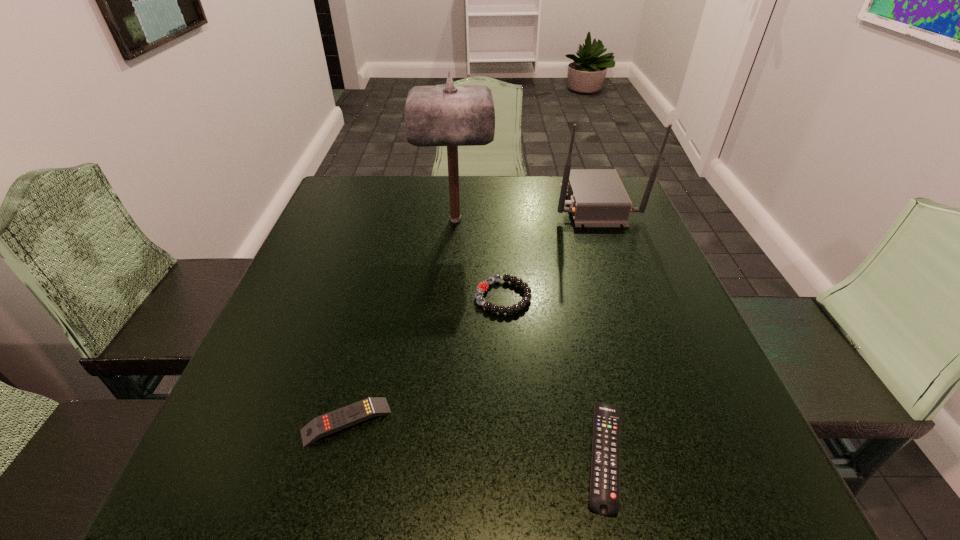
Locate an element on the screen. The width and height of the screenshot is (960, 540). the tallest object is located at coordinates (453, 115).

Locate an element on the screen. Image resolution: width=960 pixels, height=540 pixels. router is located at coordinates (597, 198).

Identify the location of the third nearest object. [483, 286].

Where is `the left remote control`? This screenshot has height=540, width=960. the left remote control is located at coordinates (334, 421).

Where is `the right remote control`? The width and height of the screenshot is (960, 540). the right remote control is located at coordinates (604, 499).

Where is `free region located 0.070m on the right of the mallet`? free region located 0.070m on the right of the mallet is located at coordinates (518, 219).

At what (x,y) coordinates should I click in order to perform the action: click on free location located 0.340m on the back of the second tallest object to connect cables. Please return your answer as a coordinate pair (x, y). Looking at the image, I should click on (430, 204).

In order to click on vacant area situated on the back of the second tallest object to connect cables in this screenshot , I will do `click(420, 204)`.

In order to click on vacant region located 0.250m on the back of the second tallest object to connect cables in this screenshot , I will do `click(463, 204)`.

Locate an element on the screen. vacant space located on the back of the bracelet is located at coordinates (499, 228).